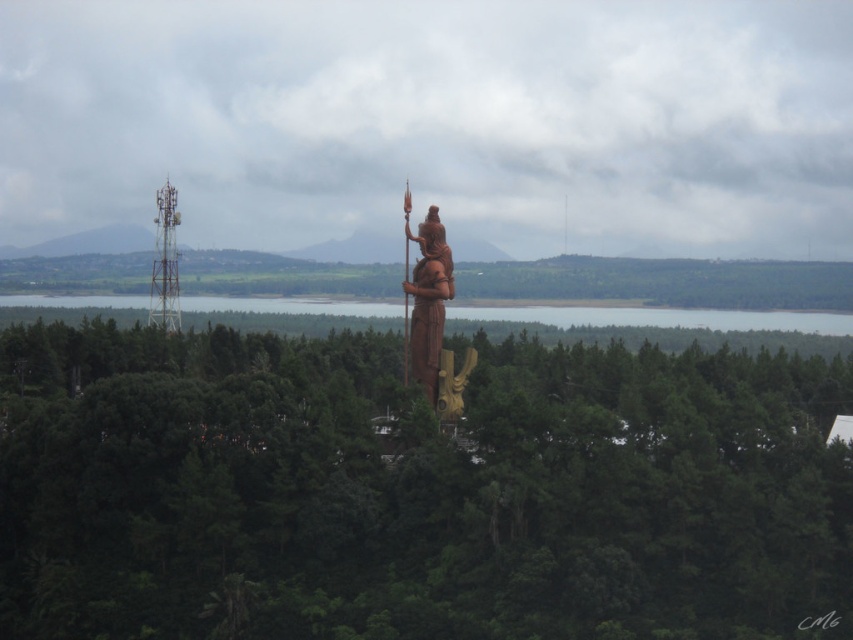
Based on the photo, you are a photographer planning to take a picture of the brown wooden statue at center and the metallic tower at left. Based on their positions, which object should you focus on first if you want to capture both in a single frame without moving the camera?

The brown wooden statue at center is located below the metallic tower at left, so you should focus on the metallic tower at left first as it is higher up in the frame to ensure both are in the shot.

You are an artist planning to paint the scene. You want to ensure the green matte tree at center and the wooden statue at center are proportionally accurate. Which object should you draw larger on your canvas?

The green matte tree at center should be drawn larger than the wooden statue at center because it is bigger than the wooden statue at center according to the description.